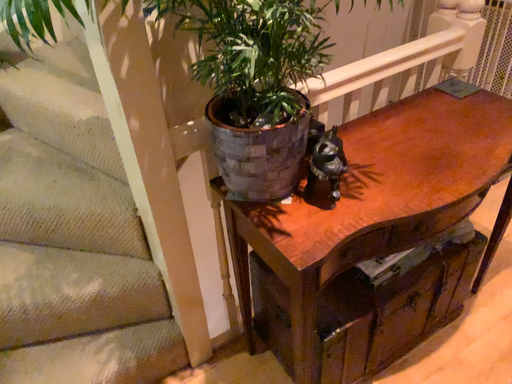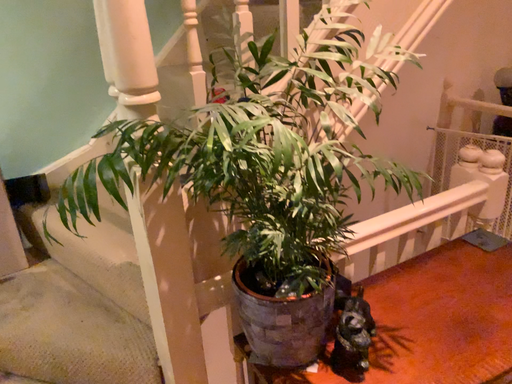
Question: How did the camera likely rotate when shooting the video?

Choices:
 (A) rotated downward
 (B) rotated upward

Answer: (B)